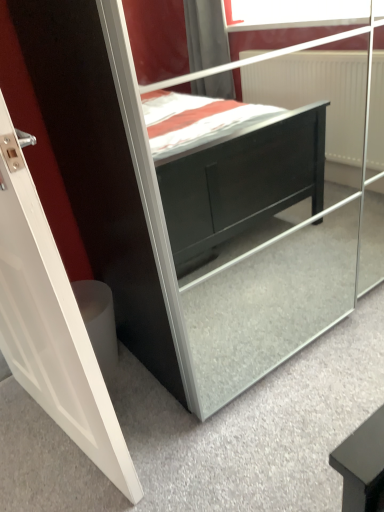
The image size is (384, 512). I want to click on unoccupied region to the right of white glossy door at left, so click(207, 413).